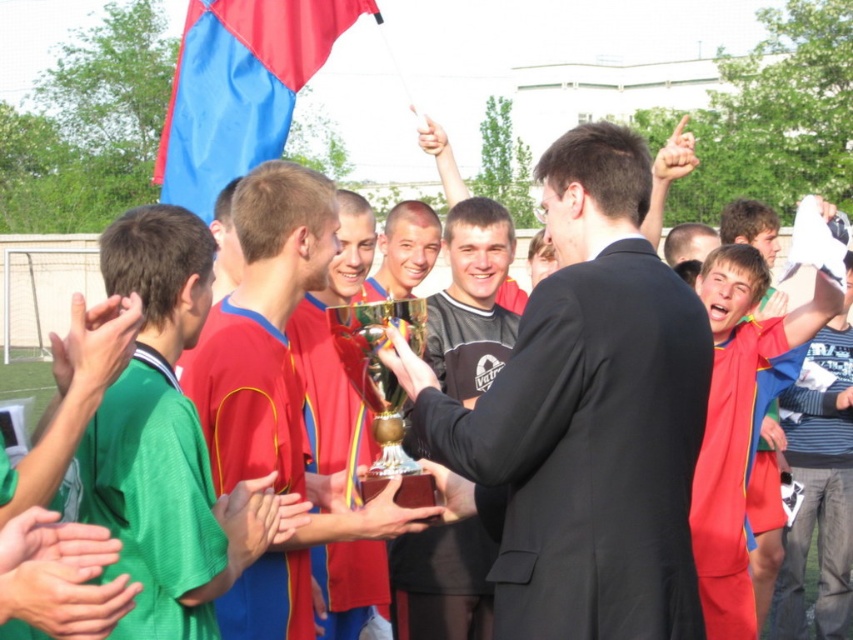
Question: Based on their relative distances, which object is nearer to the black suit at center?

Choices:
 (A) green jersey at left
 (B) green matte hand at lower left
 (C) matte black hand at upper center
 (D) gold shiny trophy at center

Answer: (D)

Question: Is brown wooden trophy at center to the left of matte gold trophy at center from the viewer's perspective?

Choices:
 (A) no
 (B) yes

Answer: (B)

Question: Can you confirm if matte black hand at upper center is wider than white matte hand at upper center?

Choices:
 (A) no
 (B) yes

Answer: (B)

Question: Among these points, which one is farthest from the camera?

Choices:
 (A) (x=344, y=470)
 (B) (x=207, y=196)
 (C) (x=402, y=362)

Answer: (B)

Question: Considering the real-world distances, which object is closest to the matte gold trophy at center?

Choices:
 (A) white matte hand at upper center
 (B) brown wooden trophy at center
 (C) green matte hand at lower left
 (D) gold metallic trophy at center

Answer: (B)

Question: Is black suit at center to the right of matte black hand at upper center from the viewer's perspective?

Choices:
 (A) no
 (B) yes

Answer: (A)